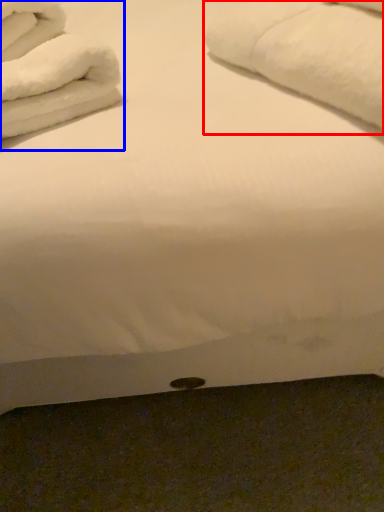
Question: Which object is closer to the camera taking this photo, bath towel (highlighted by a red box) or bath towel (highlighted by a blue box)?

Choices:
 (A) bath towel
 (B) bath towel

Answer: (A)